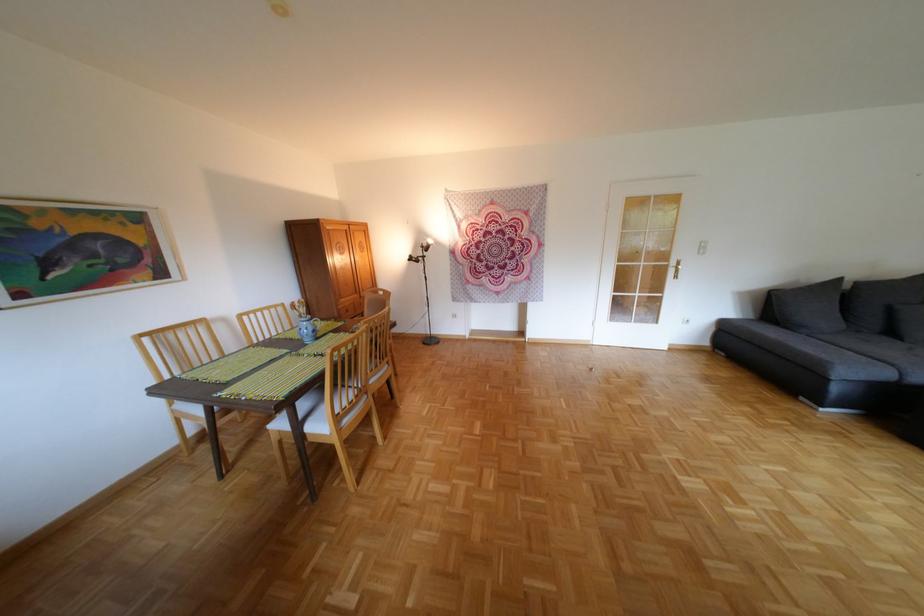
The width and height of the screenshot is (924, 616). What do you see at coordinates (315, 323) in the screenshot?
I see `the blue pitcher handle` at bounding box center [315, 323].